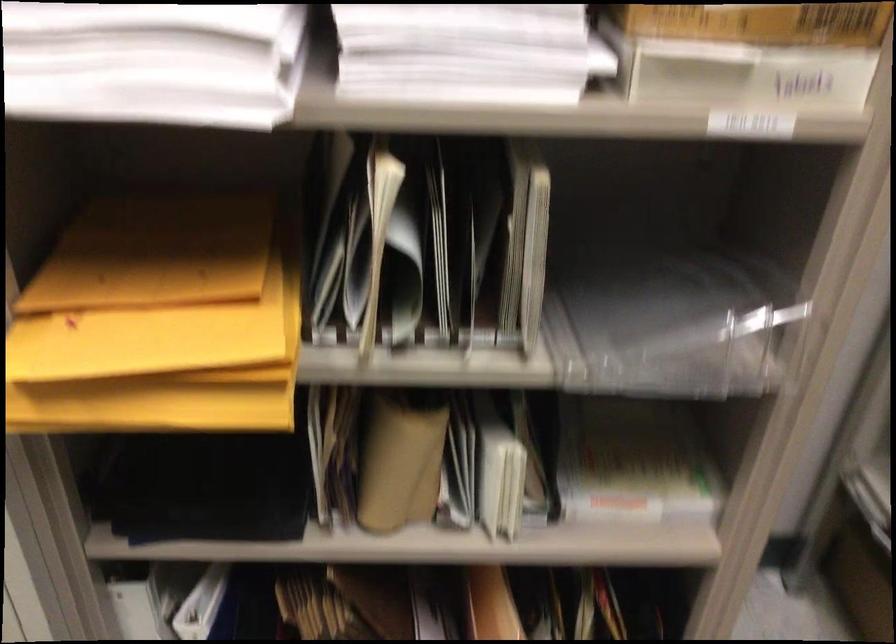
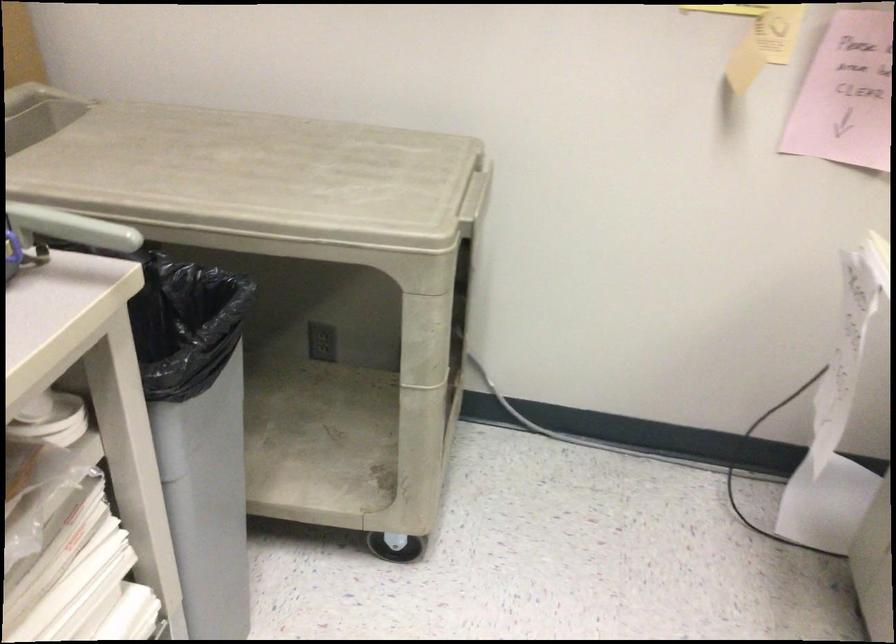
Question: What movement of the cameraman would produce the second image?

Choices:
 (A) Left
 (B) Right
 (C) Forward
 (D) Backward

Answer: (D)